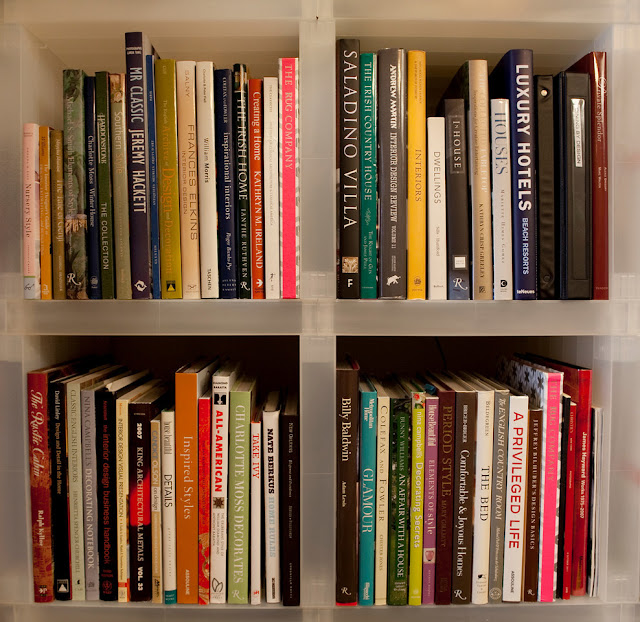
Locate an element on the screen. Image resolution: width=640 pixels, height=622 pixels. black books is located at coordinates (563, 259), (523, 261), (582, 251), (358, 453), (361, 221), (246, 241), (146, 440).